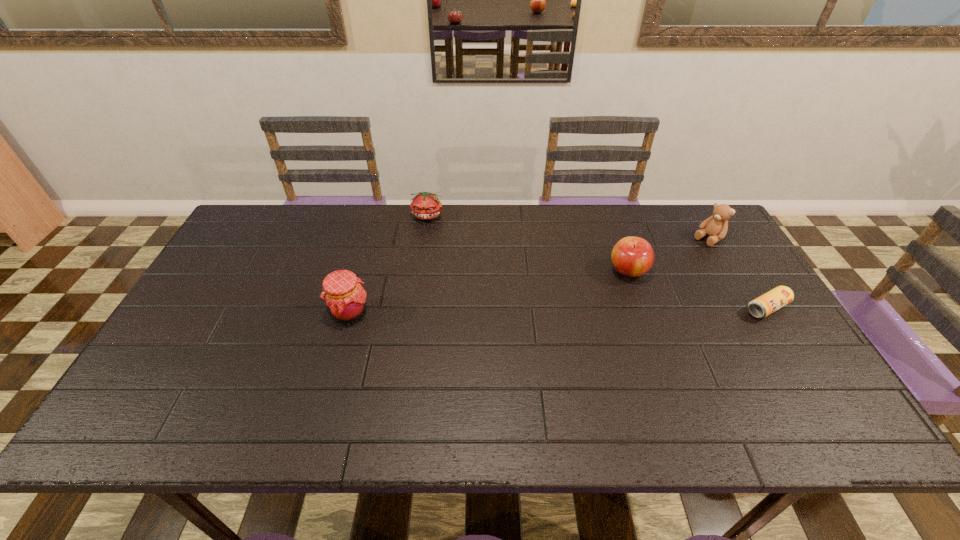
At what (x,y) coordinates should I click in order to perform the action: click on unoccupied position between the apple and the beer can. Please return your answer as a coordinate pair (x, y). The width and height of the screenshot is (960, 540). Looking at the image, I should click on (698, 289).

Identify the location of free space between the tomato and the fourth nearest object. (567, 228).

You are a GUI agent. You are given a task and a screenshot of the screen. Output one action in this format:
    pyautogui.click(x=<x>, y=<y>)
    Task: Click on the free space between the jam and the shortest object
    The width and height of the screenshot is (960, 540).
    Given the screenshot: What is the action you would take?
    pyautogui.click(x=559, y=310)

You are a GUI agent. You are given a task and a screenshot of the screen. Output one action in this format:
    pyautogui.click(x=<x>, y=<y>)
    Task: Click on the free space between the shortest object and the jam
    Image resolution: width=960 pixels, height=540 pixels.
    Given the screenshot: What is the action you would take?
    pyautogui.click(x=559, y=310)

Locate an element on the screen. vacant point located between the second object from left to right and the third object from left to right is located at coordinates (528, 244).

This screenshot has width=960, height=540. Identify the location of vacant space that's between the beer can and the tomato. (597, 262).

This screenshot has height=540, width=960. I want to click on free area in between the beer can and the tomato, so click(x=597, y=262).

This screenshot has height=540, width=960. Find the location of `vacant area that lies between the jam and the third object from right to left`. vacant area that lies between the jam and the third object from right to left is located at coordinates (489, 292).

The image size is (960, 540). In order to click on vacant area between the third object from right to left and the fourth tallest object in this screenshot , I will do `click(528, 244)`.

You are a GUI agent. You are given a task and a screenshot of the screen. Output one action in this format:
    pyautogui.click(x=<x>, y=<y>)
    Task: Click on the free space between the leftmost object and the shortest object
    
    Given the screenshot: What is the action you would take?
    pyautogui.click(x=559, y=310)